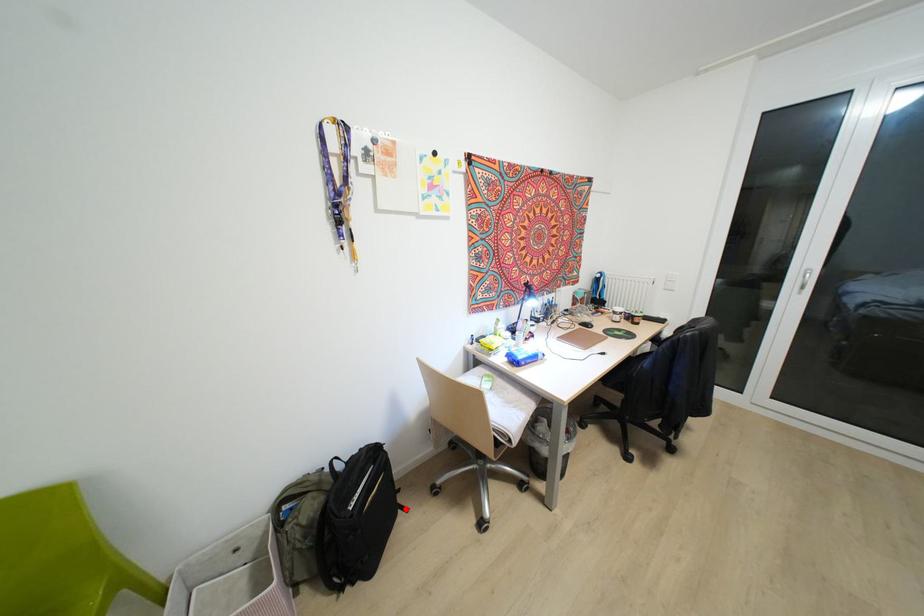
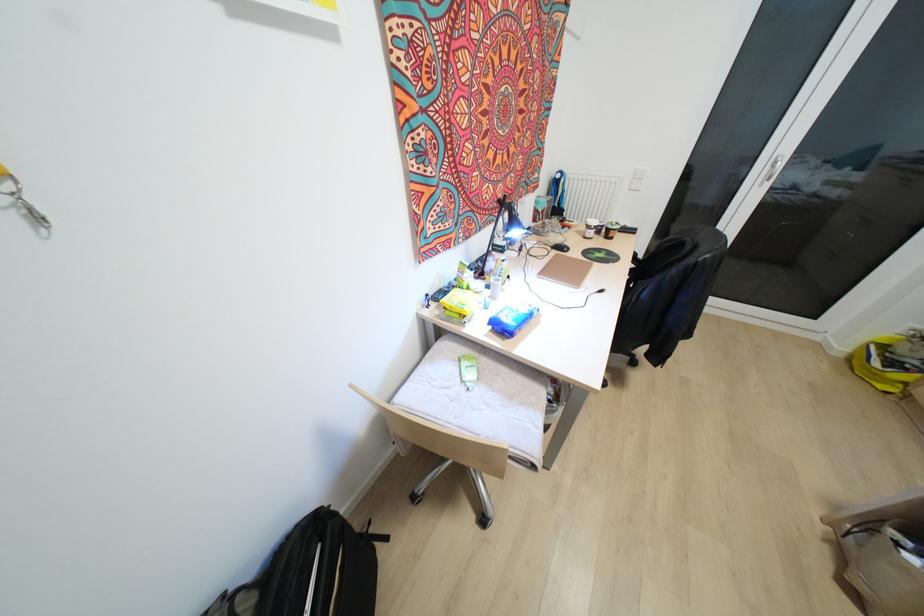
In the second image, find the point that corresponds to the highlighted location in the first image.

(385, 538)